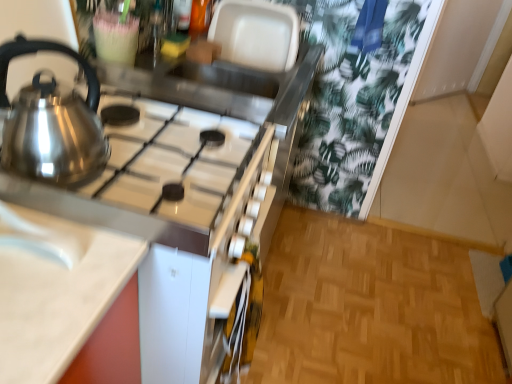
Question: From a real-world perspective, is satin silver gas stove at upper left positioned above or below white glossy sink at lower left?

Choices:
 (A) above
 (B) below

Answer: (B)

Question: Is satin silver gas stove at upper left wider or thinner than white glossy sink at lower left?

Choices:
 (A) thin
 (B) wide

Answer: (B)

Question: Estimate the real-world distances between objects in this image. Which object is closer to the white glossy sink at lower left?

Choices:
 (A) satin metallic kettle at left
 (B) satin silver gas stove at upper left

Answer: (A)

Question: Estimate the real-world distances between objects in this image. Which object is closer to the white glossy sink at lower left?

Choices:
 (A) satin metallic kettle at left
 (B) satin silver gas stove at upper left

Answer: (A)